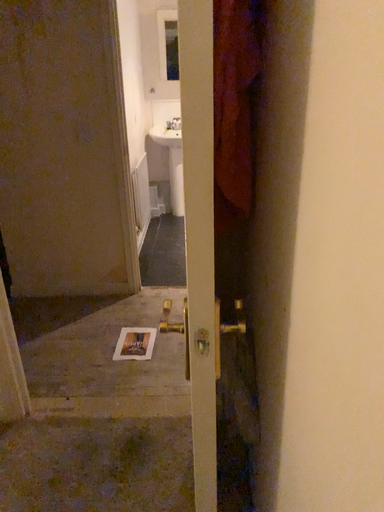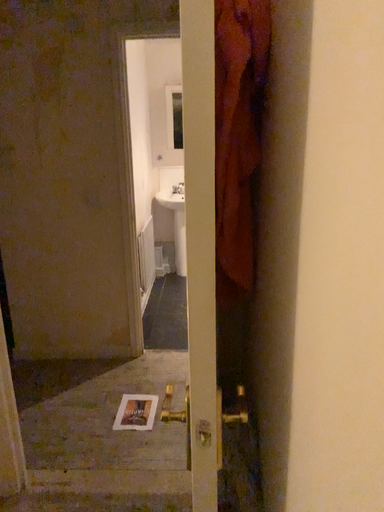
Question: How did the camera likely rotate when shooting the video?

Choices:
 (A) rotated downward
 (B) rotated upward

Answer: (B)